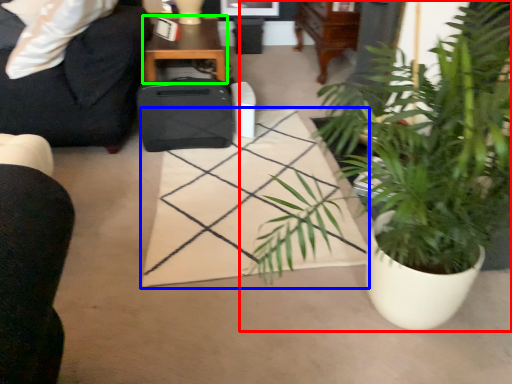
Question: Estimate the real-world distances between objects in this image. Which object is farther from houseplant (highlighted by a red box), plain (highlighted by a blue box) or table (highlighted by a green box)?

Choices:
 (A) plain
 (B) table

Answer: (B)